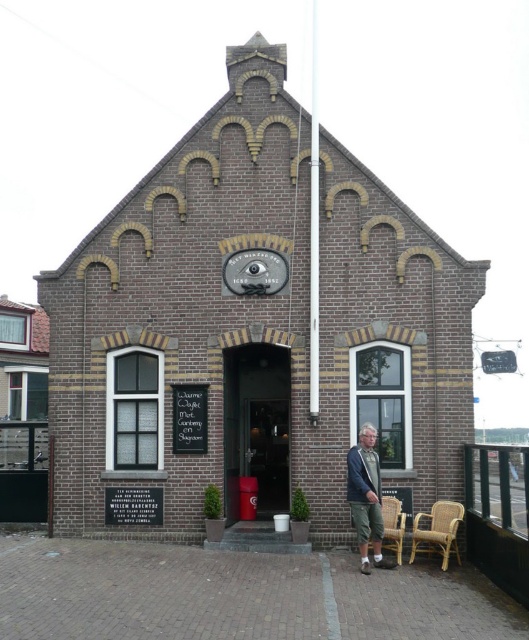
Can you confirm if denim jacket at lower right is positioned above wicker chair at lower right?

Yes, denim jacket at lower right is above wicker chair at lower right.

Does denim jacket at lower right have a larger size compared to wicker chair at lower right?

Indeed, denim jacket at lower right has a larger size compared to wicker chair at lower right.

Does point (364, 483) come in front of point (390, 548)?

Yes, it is in front of point (390, 548).

At what (x,y) coordinates should I click in order to perform the action: click on denim jacket at lower right. Please return your answer as a coordinate pair (x, y). The height and width of the screenshot is (640, 529). Looking at the image, I should click on (366, 497).

Is the position of brown brick building at center less distant than that of wicker chair at lower right?

No, brown brick building at center is behind wicker chair at lower right.

Is brown brick building at center below wicker chair at lower right?

No, brown brick building at center is not below wicker chair at lower right.

Does point (159, 531) lie in front of point (387, 532)?

No.

In order to click on brown brick building at center in this screenshot , I will do `click(253, 330)`.

Can you confirm if brown brick building at center is positioned to the right of rattan chair at lower right?

No, brown brick building at center is not to the right of rattan chair at lower right.

Between brown brick building at center and rattan chair at lower right, which one has less height?

With less height is rattan chair at lower right.

Which is in front, point (360, 417) or point (446, 520)?

Point (446, 520) is in front.

You are a GUI agent. You are given a task and a screenshot of the screen. Output one action in this format:
    pyautogui.click(x=<x>, y=<y>)
    Task: Click on the brown brick building at center
    
    Given the screenshot: What is the action you would take?
    pyautogui.click(x=253, y=330)